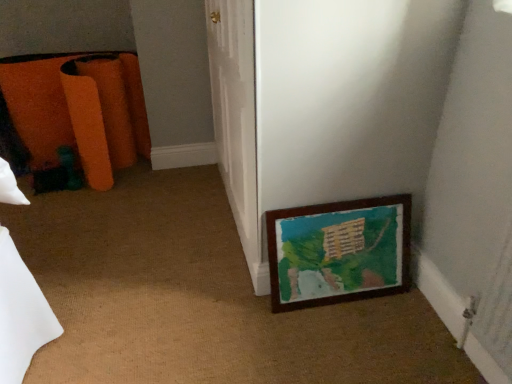
Image resolution: width=512 pixels, height=384 pixels. What do you see at coordinates (340, 250) in the screenshot?
I see `wooden picture frame at lower right` at bounding box center [340, 250].

I want to click on wooden picture frame at lower right, so click(x=340, y=250).

The height and width of the screenshot is (384, 512). What are the coordinates of `wooden picture frame at lower right` in the screenshot? It's located at (340, 250).